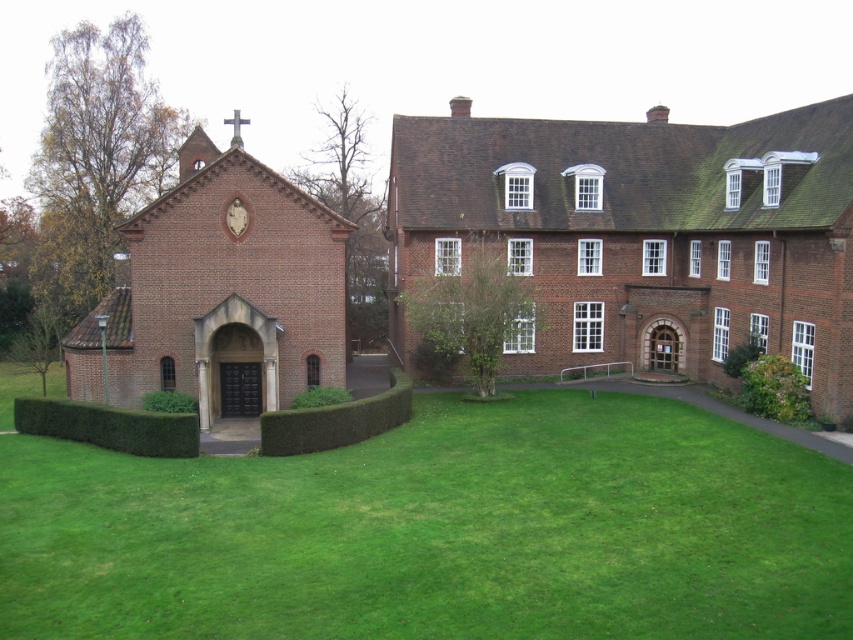
Question: Is brown brick building at center wider than brown brick chapel at left?

Choices:
 (A) no
 (B) yes

Answer: (B)

Question: Which point is closer to the camera taking this photo?

Choices:
 (A) (192, 291)
 (B) (196, 484)
 (C) (828, 396)

Answer: (B)

Question: Which object is the farthest from the brown brick chapel at left?

Choices:
 (A) brown brick building at center
 (B) green grass at lower left

Answer: (A)

Question: Among these objects, which one is farthest from the camera?

Choices:
 (A) brown brick chapel at left
 (B) brown brick building at center

Answer: (A)

Question: Does green grass at lower left come behind brown brick chapel at left?

Choices:
 (A) yes
 (B) no

Answer: (B)

Question: Is green grass at lower left bigger than brown brick building at center?

Choices:
 (A) yes
 (B) no

Answer: (B)